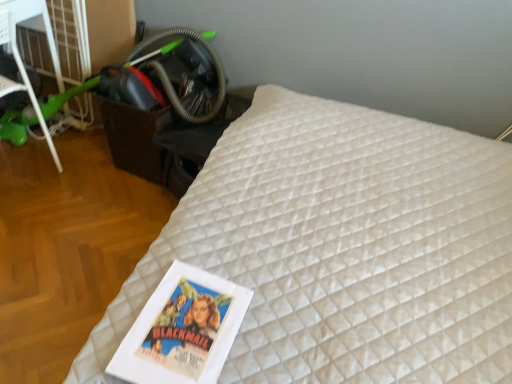
Image resolution: width=512 pixels, height=384 pixels. Describe the element at coordinates (20, 56) in the screenshot. I see `green plastic scooter at left` at that location.

Where is `black plastic table at lower left`? The image size is (512, 384). black plastic table at lower left is located at coordinates (164, 141).

The image size is (512, 384). Find the location of `bed below the green plastic scooter at left (from the image's perspective)`. bed below the green plastic scooter at left (from the image's perspective) is located at coordinates (342, 248).

Based on the photo, are white quilted mattress at center and green plastic scooter at left located far from each other?

white quilted mattress at center is positioned a significant distance from green plastic scooter at left.

From the image's perspective, is white quilted mattress at center located beneath green plastic scooter at left?

Yes, from the image's perspective, white quilted mattress at center is beneath green plastic scooter at left.

Does point (479, 177) appear closer or farther from the camera than point (38, 7)?

Clearly, point (479, 177) is closer to the camera than point (38, 7).

Find the location of a particular element. This screenshot has height=384, width=512. table that is behind the green plastic scooter at left is located at coordinates (164, 141).

From the picture: From a real-world perspective, between green plastic scooter at left and black plastic table at lower left, who is vertically higher?

green plastic scooter at left, from a real-world perspective.

From the image's perspective, is green plastic scooter at left located beneath black plastic table at lower left?

No, from the image's perspective, green plastic scooter at left is not below black plastic table at lower left.

Is green plastic scooter at left at the left side of black plastic table at lower left?

Yes.

From the image's perspective, which is below, white quilted mattress at center or black plastic table at lower left?

white quilted mattress at center.

From a real-world perspective, relative to black plastic table at lower left, is white quilted mattress at center vertically above or below?

white quilted mattress at center is situated higher than black plastic table at lower left in the real world.

Can you confirm if white quilted mattress at center is wider than black plastic table at lower left?

Yes, white quilted mattress at center is wider than black plastic table at lower left.

Between white quilted mattress at center and black plastic table at lower left, which one appears on the left side from the viewer's perspective?

From the viewer's perspective, black plastic table at lower left appears more on the left side.

Locate an element on the screen. The width and height of the screenshot is (512, 384). table located above the white quilted mattress at center (from the image's perspective) is located at coordinates (164, 141).

Is black plastic table at lower left directly adjacent to white quilted mattress at center?

black plastic table at lower left and white quilted mattress at center are not in contact.

Which is behind, black plastic table at lower left or white quilted mattress at center?

Positioned behind is black plastic table at lower left.

In the scene shown: From the image's perspective, between black plastic table at lower left and white quilted mattress at center, which one is located above?

black plastic table at lower left appears higher in the image.

Looking at this image, between green plastic scooter at left and white quilted mattress at center, which one has larger width?

Wider between the two is white quilted mattress at center.

Consider the image. Can you confirm if green plastic scooter at left is bigger than white quilted mattress at center?

Incorrect, green plastic scooter at left is not larger than white quilted mattress at center.

Is green plastic scooter at left beside white quilted mattress at center?

No, green plastic scooter at left is not beside white quilted mattress at center.

You are a GUI agent. You are given a task and a screenshot of the screen. Output one action in this format:
    pyautogui.click(x=<x>, y=<y>)
    Task: Click on the furniture located on the left of white quilted mattress at center
    This screenshot has width=512, height=384.
    Given the screenshot: What is the action you would take?
    pyautogui.click(x=20, y=56)

Which object is further away from the camera, black plastic table at lower left or green plastic scooter at left?

black plastic table at lower left is further from the camera.

What's the angular difference between black plastic table at lower left and green plastic scooter at left's facing directions?

They differ by 87.1 degrees in their facing directions.

Is black plastic table at lower left surrounding green plastic scooter at left?

Actually, green plastic scooter at left is outside black plastic table at lower left.

Are black plastic table at lower left and green plastic scooter at left located far from each other?

That's not correct — black plastic table at lower left is a little close to green plastic scooter at left.

Where is `bed in front of the green plastic scooter at left`? This screenshot has width=512, height=384. bed in front of the green plastic scooter at left is located at coordinates (342, 248).

What are the coordinates of `table located underneath the green plastic scooter at left (from a real-world perspective)` in the screenshot? It's located at (164, 141).

From the image, which object appears to be farther from green plastic scooter at left, black plastic table at lower left or white quilted mattress at center?

Among the two, white quilted mattress at center is located further to green plastic scooter at left.

Considering their positions, is white quilted mattress at center positioned closer to black plastic table at lower left than green plastic scooter at left?

green plastic scooter at left lies closer to black plastic table at lower left than the other object.

Estimate the real-world distances between objects in this image. Which object is further from white quilted mattress at center, black plastic table at lower left or green plastic scooter at left?

green plastic scooter at left is positioned further to the anchor white quilted mattress at center.

Looking at the image, which one is located closer to white quilted mattress at center, green plastic scooter at left or black plastic table at lower left?

Based on the image, black plastic table at lower left appears to be nearer to white quilted mattress at center.

When comparing their distances from black plastic table at lower left, does green plastic scooter at left or white quilted mattress at center seem closer?

green plastic scooter at left.

Which object lies nearer to the anchor point green plastic scooter at left, white quilted mattress at center or black plastic table at lower left?

black plastic table at lower left is closer to green plastic scooter at left.

This screenshot has height=384, width=512. I want to click on table between green plastic scooter at left and white quilted mattress at center in the horizontal direction, so click(x=164, y=141).